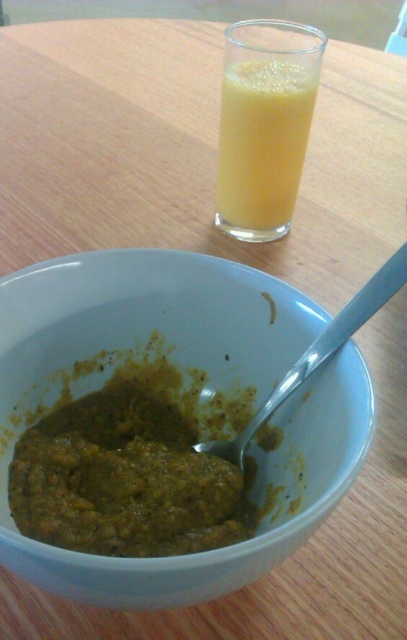
You are setting up a table for a meal. You have a matte ceramic bowl at center and a yellow translucent glass at upper center. Which object is taller?

The matte ceramic bowl at center is taller than the yellow translucent glass at upper center according to the description.

You are a person sitting at the wooden table and want to reach for the matte ceramic bowl at center and the yellow translucent glass at upper center. Which object will you need to reach lower to get?

You will need to reach lower to get the matte ceramic bowl at center because it is located below the yellow translucent glass at upper center.

You are setting up a table for a meal. You have a matte ceramic bowl at center and a silver metallic spoon at bowl center. Where should you place the spoon so that it doesn not fall into the bowl?

The silver metallic spoon at bowl center is currently positioned over the matte ceramic bowl at center, so to prevent it from falling into the bowl, you should place the spoon beside the matte ceramic bowl at center instead of above it.